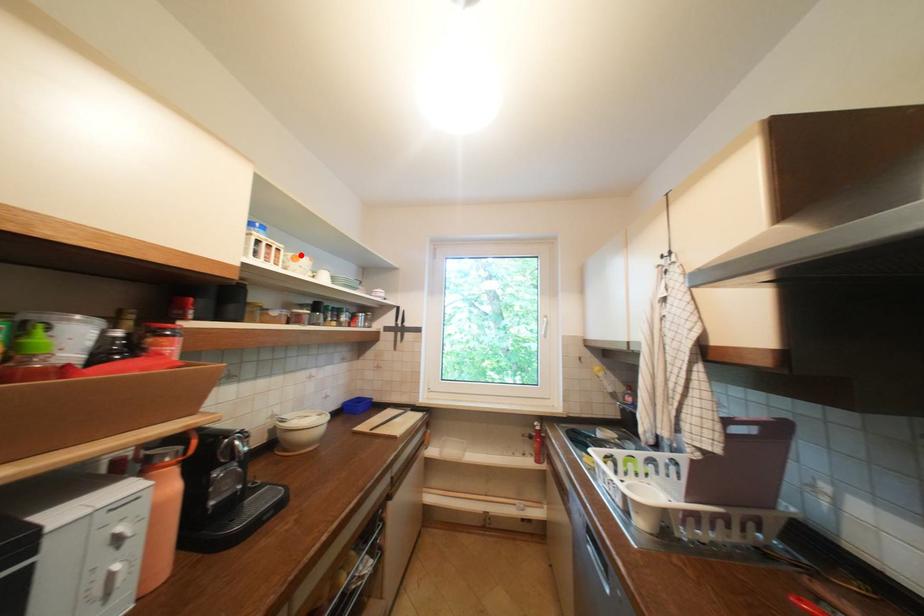
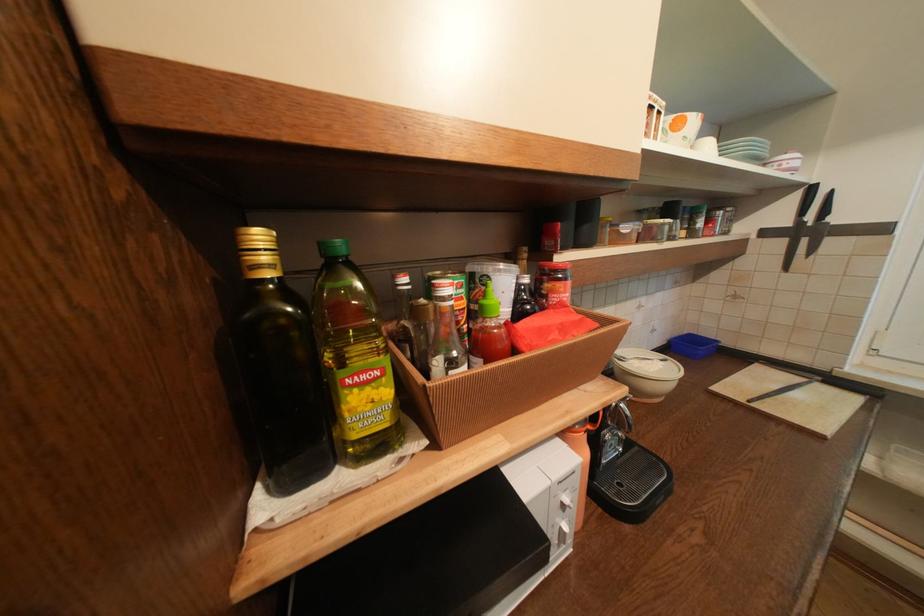
The point at the highlighted location is marked in the first image. Where is the corresponding point in the second image?

(683, 118)